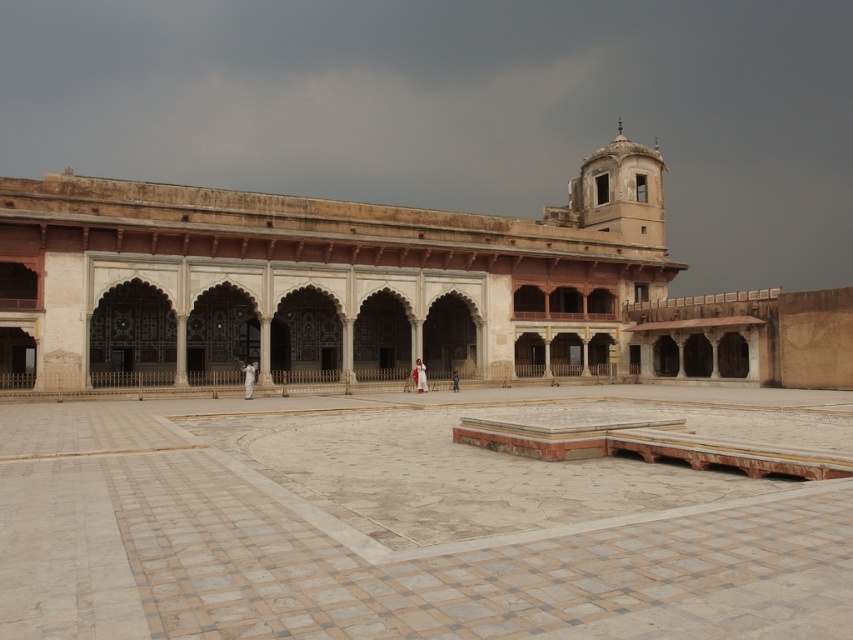
Question: Can you confirm if white marble courtyard at center is positioned to the left of beige stone palace at center?

Choices:
 (A) yes
 (B) no

Answer: (A)

Question: Is white marble courtyard at center to the left of beige stone palace at center from the viewer's perspective?

Choices:
 (A) no
 (B) yes

Answer: (B)

Question: Is white marble courtyard at center to the right of beige stone palace at center from the viewer's perspective?

Choices:
 (A) no
 (B) yes

Answer: (A)

Question: Which point is farther to the camera?

Choices:
 (A) (314, 317)
 (B) (560, 464)

Answer: (A)

Question: Which object is farther from the camera taking this photo?

Choices:
 (A) beige stone palace at center
 (B) white marble courtyard at center

Answer: (A)

Question: Among these points, which one is farthest from the camera?

Choices:
 (A) (657, 173)
 (B) (366, 506)

Answer: (A)